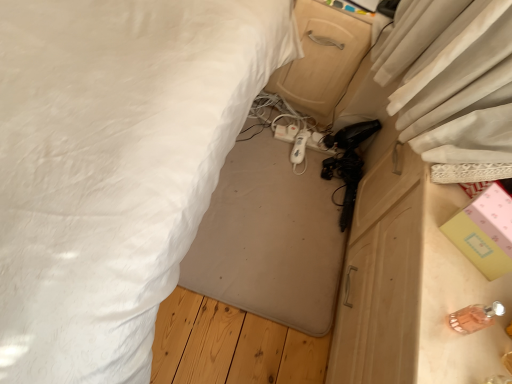
Where is `free point to the left of pink paper box at right`? free point to the left of pink paper box at right is located at coordinates tap(428, 215).